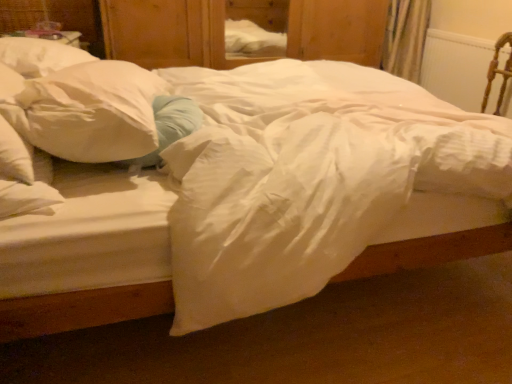
Question: Is white plastic radiator at upper right in front of or behind wooden armchair at right in the image?

Choices:
 (A) behind
 (B) front

Answer: (A)

Question: Looking at their shapes, would you say white plastic radiator at upper right is wider or thinner than wooden armchair at right?

Choices:
 (A) thin
 (B) wide

Answer: (A)

Question: Considering the real-world distances, which object is farthest from the wooden armchair at right?

Choices:
 (A) white plastic radiator at upper right
 (B) wooden dresser at center
 (C) white soft pillow at left

Answer: (C)

Question: Estimate the real-world distances between objects in this image. Which object is farther from the white soft pillow at left?

Choices:
 (A) wooden dresser at center
 (B) white plastic radiator at upper right
 (C) wooden armchair at right

Answer: (B)